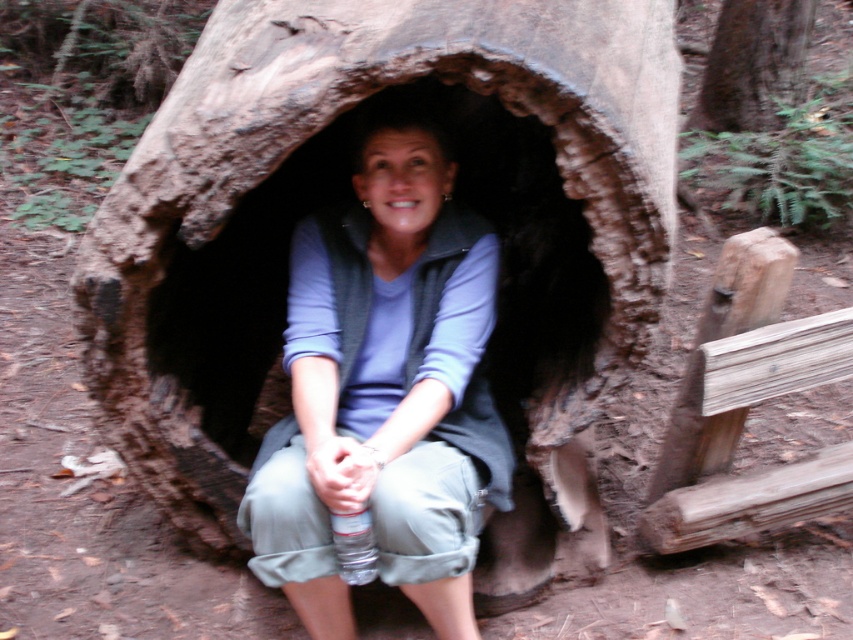
You are standing in front of the hollowed tree trunk shelter and want to place a small decoration. You have two points marked on the tree trunk at coordinates point (419, 420) and point (740, 86). Which point is closer to you so that the decoration will be more visible?

Point (419, 420) is closer to the viewer than point (740, 86), so placing the decoration there would make it more visible.

You are standing in front of the hollowed tree trunk and see the person sitting inside. The person is wearing a matte gray vest at center. If you want to hand them a tool that is 6 feet long, will the tool reach them?

The matte gray vest at center is 5.48 feet from the viewer. Since the tool is 6 feet long, it will reach the person as it is longer than the distance.